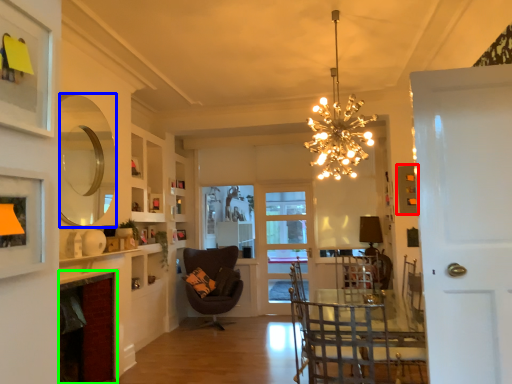
Question: Which object is positioned closest to picture frame (highlighted by a red box)? Select from mirror (highlighted by a blue box) and fireplace (highlighted by a green box).

Choices:
 (A) mirror
 (B) fireplace

Answer: (A)